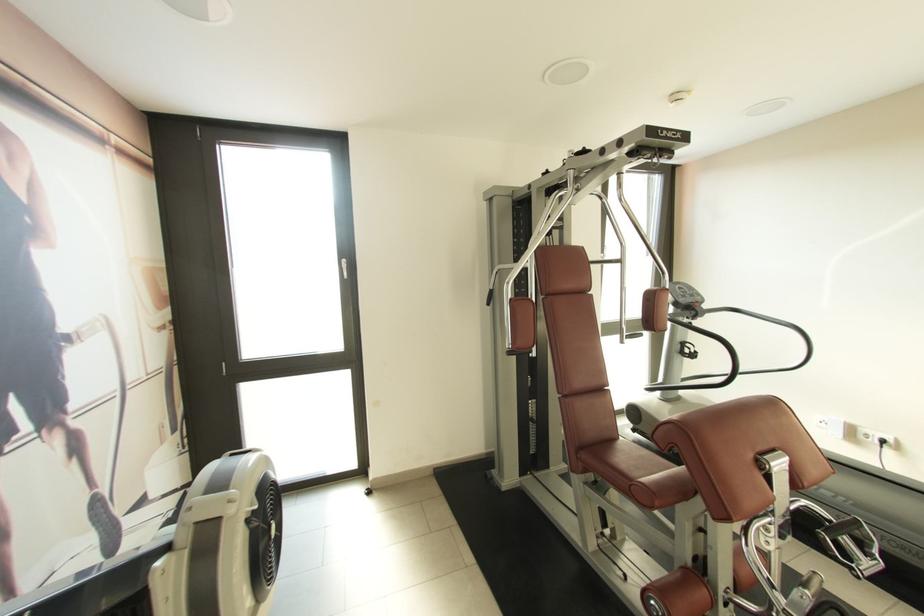
You are a GUI agent. You are given a task and a screenshot of the screen. Output one action in this format:
    pyautogui.click(x=<x>, y=<y>)
    Task: Click on the brown leather seat
    
    Given the screenshot: What is the action you would take?
    pyautogui.click(x=623, y=464)